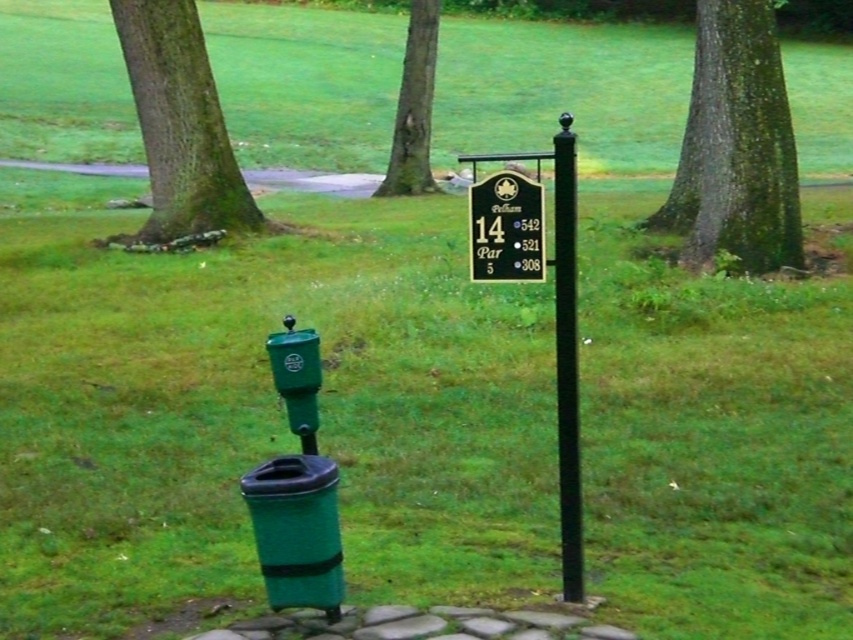
Question: Which is nearer to the green mossy tree at upper left?

Choices:
 (A) black polished wood sign at center
 (B) green mossy bark tree at upper right
 (C) black polished pole at center

Answer: (B)

Question: Does green mossy bark tree at upper right appear over green bark tree at center?

Choices:
 (A) no
 (B) yes

Answer: (A)

Question: Which object appears farthest from the camera in this image?

Choices:
 (A) green mossy tree at upper left
 (B) green bark tree at center
 (C) green mossy bark tree at upper right

Answer: (B)

Question: Can you confirm if green mossy bark tree at upper right is thinner than black polished pole at center?

Choices:
 (A) no
 (B) yes

Answer: (A)

Question: Among these points, which one is farthest from the camera?

Choices:
 (A) (578, 547)
 (B) (192, 125)
 (C) (486, 243)
 (D) (683, 193)

Answer: (D)

Question: Considering the relative positions of green mossy tree at upper left and green bark tree at center in the image provided, where is green mossy tree at upper left located with respect to green bark tree at center?

Choices:
 (A) left
 (B) right

Answer: (A)